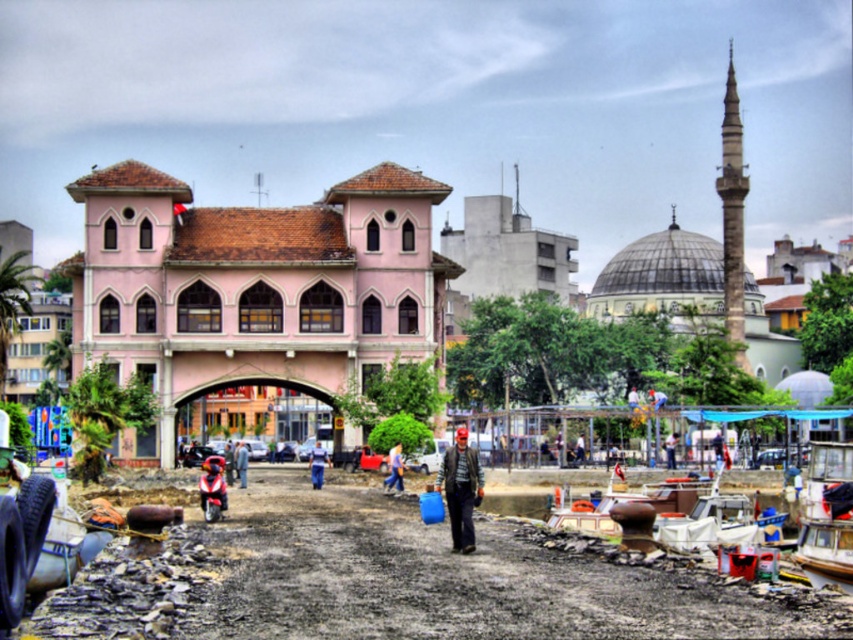
Which is above, wooden boat at lower right or blue denim jeans at center?

wooden boat at lower right

Can you confirm if wooden boat at lower right is taller than blue denim jeans at center?

Yes.

What do you see at coordinates (827, 516) in the screenshot? Image resolution: width=853 pixels, height=640 pixels. I see `wooden boat at lower right` at bounding box center [827, 516].

Image resolution: width=853 pixels, height=640 pixels. I want to click on wooden boat at lower right, so click(827, 516).

Looking at this image, can you confirm if pink matte building at center is bigger than white plastic boat at lower right?

Yes, pink matte building at center is bigger than white plastic boat at lower right.

Does pink matte building at center come in front of white plastic boat at lower right?

No, it is not.

Which is in front, point (166, 328) or point (677, 529)?

Point (677, 529) is in front.

Image resolution: width=853 pixels, height=640 pixels. What are the coordinates of `pink matte building at center` in the screenshot? It's located at (252, 288).

Describe the element at coordinates (827, 516) in the screenshot. I see `wooden boat at lower right` at that location.

Can you confirm if wooden boat at lower right is smaller than white plastic boat at lower right?

Incorrect, wooden boat at lower right is not smaller in size than white plastic boat at lower right.

Is point (817, 460) farther from viewer compared to point (753, 522)?

Yes, point (817, 460) is behind point (753, 522).

You are a GUI agent. You are given a task and a screenshot of the screen. Output one action in this format:
    pyautogui.click(x=<x>, y=<y>)
    Task: Click on the wooden boat at lower right
    
    Given the screenshot: What is the action you would take?
    pyautogui.click(x=827, y=516)